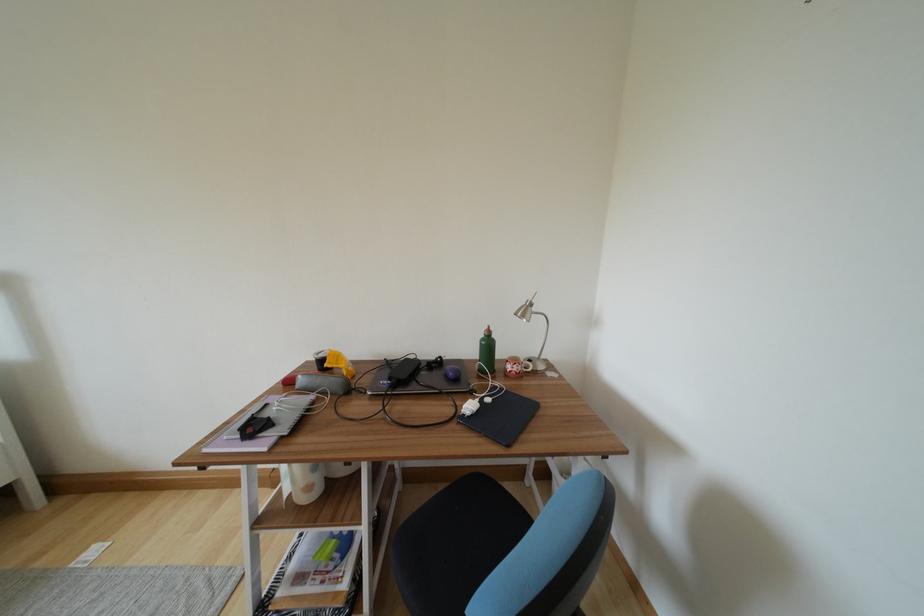
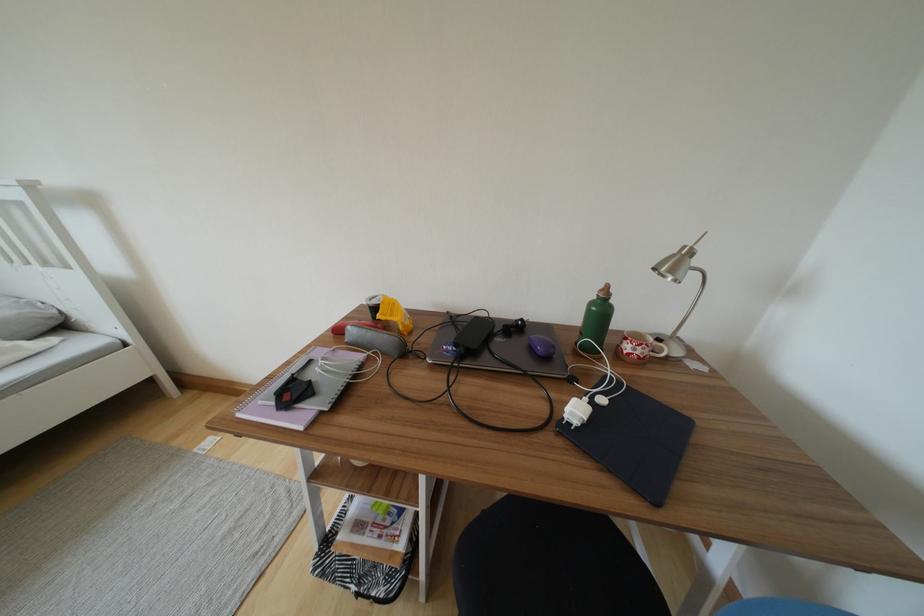
What movement of the cameraman would produce the second image?

The cameraman moved toward left, forward.